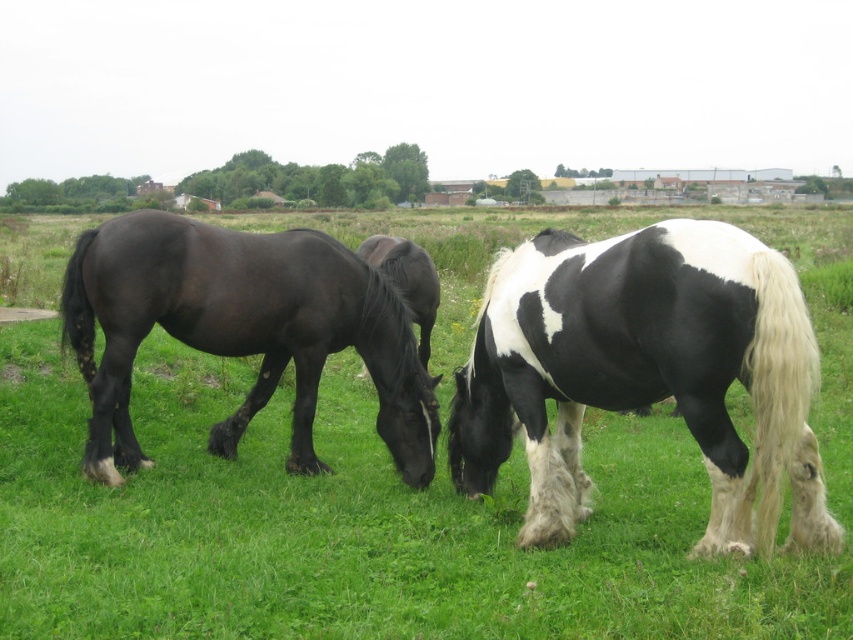
You are a photographer aiming to capture the black and white speckled coat at center and the green grass at center in your shot. Which object is positioned higher in the frame?

The green grass at center is above the black and white speckled coat at center, so the green grass at center is higher in the frame.